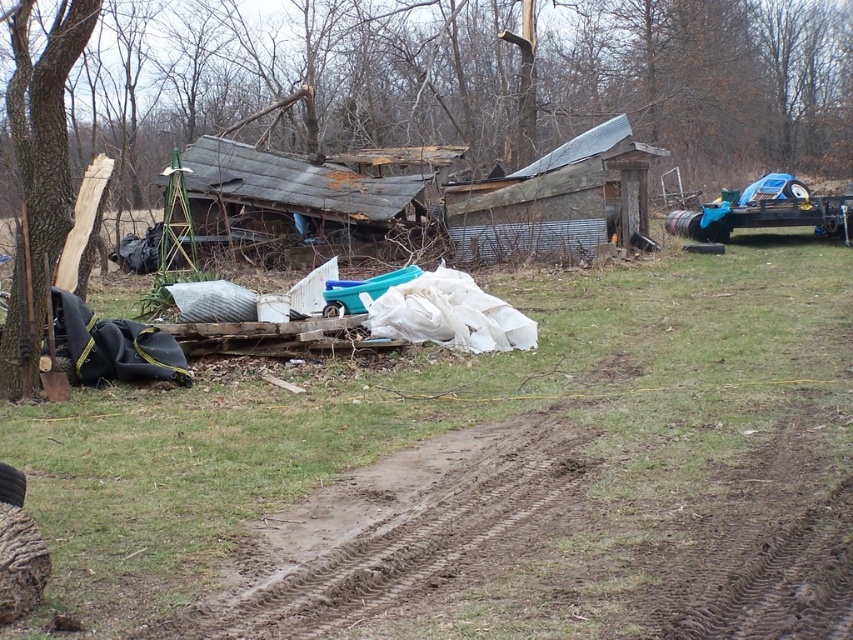
Question: Does brown dirt field at center have a larger size compared to brown rough wood at left?

Choices:
 (A) no
 (B) yes

Answer: (B)

Question: Can you confirm if brown wood tree at left is bigger than rusty corrugated metal hut at center?

Choices:
 (A) no
 (B) yes

Answer: (B)

Question: Does brown wood tree at left appear on the left side of rusty corrugated metal hut at center?

Choices:
 (A) yes
 (B) no

Answer: (B)

Question: Which of these objects is positioned farthest from the brown rough wood at left?

Choices:
 (A) brown wood tree at left
 (B) rusty corrugated metal hut at center
 (C) brown dirt field at center
 (D) rusty corrugated tin hut at center

Answer: (A)

Question: Among these points, which one is farthest from the camera?

Choices:
 (A) (413, 461)
 (B) (280, 220)
 (C) (9, 371)

Answer: (B)

Question: Among these objects, which one is nearest to the camera?

Choices:
 (A) rusty corrugated metal hut at center
 (B) rusty corrugated tin hut at center
 (C) brown dirt field at center

Answer: (C)